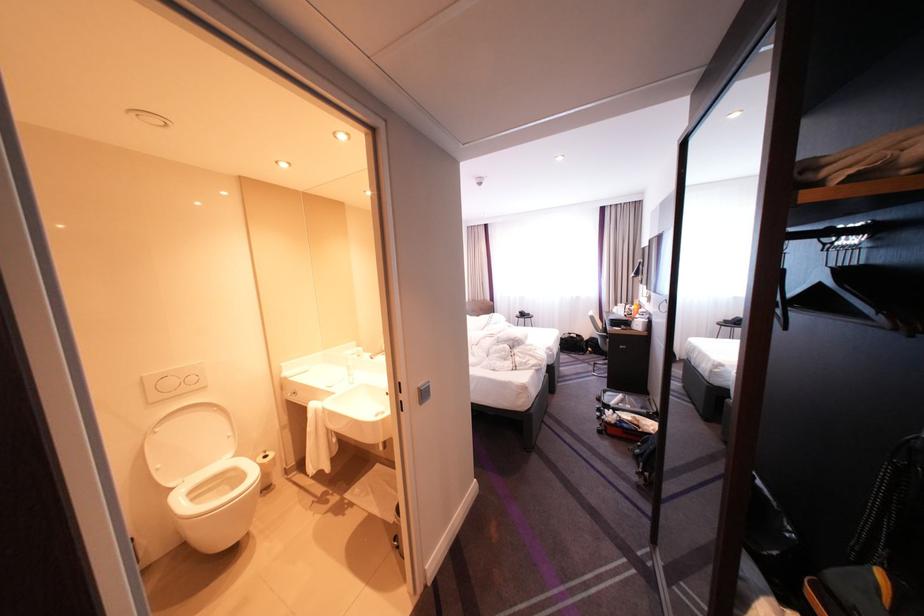
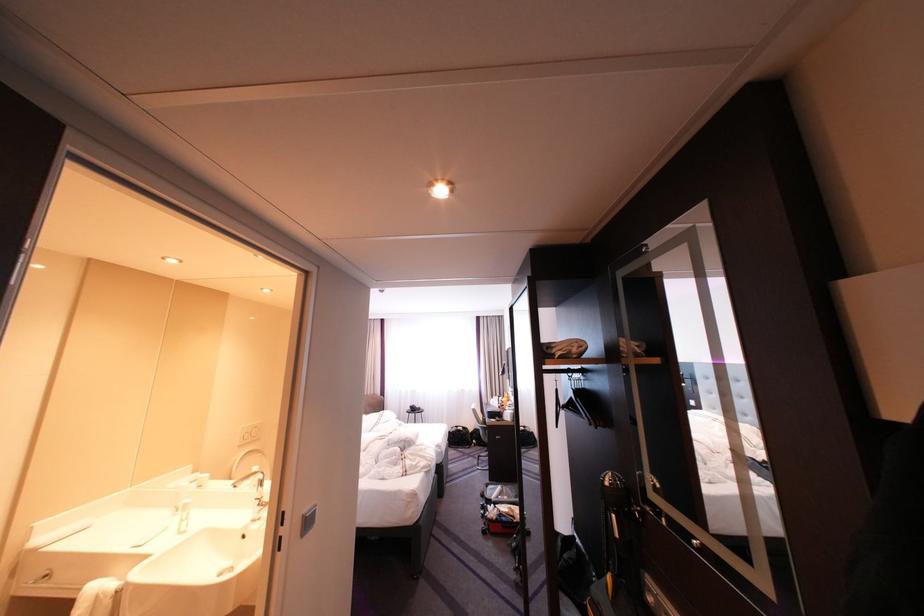
In the second image, find the point that corresponds to pixel 610 331 in the first image.

(491, 424)